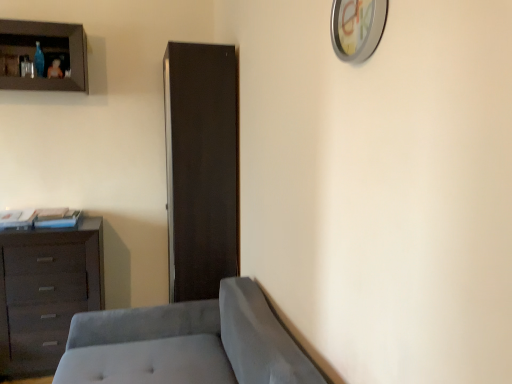
Question: Would you say matte brown cabinet at upper left is outside dark brown wooden chest of drawers at left?

Choices:
 (A) no
 (B) yes

Answer: (B)

Question: Is matte brown cabinet at upper left to the right of dark brown wooden chest of drawers at left from the viewer's perspective?

Choices:
 (A) no
 (B) yes

Answer: (A)

Question: Is matte brown cabinet at upper left facing towards dark brown wooden chest of drawers at left?

Choices:
 (A) no
 (B) yes

Answer: (A)

Question: Is matte brown cabinet at upper left looking in the opposite direction of dark brown wooden chest of drawers at left?

Choices:
 (A) yes
 (B) no

Answer: (B)

Question: Considering the relative positions of matte brown cabinet at upper left and dark brown wooden chest of drawers at left in the image provided, is matte brown cabinet at upper left in front of dark brown wooden chest of drawers at left?

Choices:
 (A) yes
 (B) no

Answer: (A)

Question: From the image's perspective, is metallic clock at upper right positioned above or below matte brown cabinet at upper left?

Choices:
 (A) below
 (B) above

Answer: (A)

Question: Based on their sizes in the image, would you say metallic clock at upper right is bigger or smaller than matte brown cabinet at upper left?

Choices:
 (A) big
 (B) small

Answer: (B)

Question: Is point (349, 3) positioned closer to the camera than point (5, 21)?

Choices:
 (A) closer
 (B) farther

Answer: (A)

Question: In the image, is metallic clock at upper right on the left side or the right side of matte brown cabinet at upper left?

Choices:
 (A) right
 (B) left

Answer: (A)

Question: In terms of height, does matte brown cabinet at upper left look taller or shorter compared to matte black cabinet at center?

Choices:
 (A) short
 (B) tall

Answer: (A)

Question: From the image's perspective, is matte brown cabinet at upper left located above or below matte black cabinet at center?

Choices:
 (A) above
 (B) below

Answer: (A)

Question: Is matte brown cabinet at upper left wider or thinner than matte black cabinet at center?

Choices:
 (A) thin
 (B) wide

Answer: (A)

Question: Considering the relative positions of matte brown cabinet at upper left and matte black cabinet at center in the image provided, is matte brown cabinet at upper left to the left or to the right of matte black cabinet at center?

Choices:
 (A) left
 (B) right

Answer: (A)

Question: From a real-world perspective, relative to dark brown wooden chest of drawers at left, is matte brown cabinet at upper left vertically above or below?

Choices:
 (A) below
 (B) above

Answer: (B)

Question: Considering the positions of matte brown cabinet at upper left and dark brown wooden chest of drawers at left in the image, is matte brown cabinet at upper left taller or shorter than dark brown wooden chest of drawers at left?

Choices:
 (A) tall
 (B) short

Answer: (B)